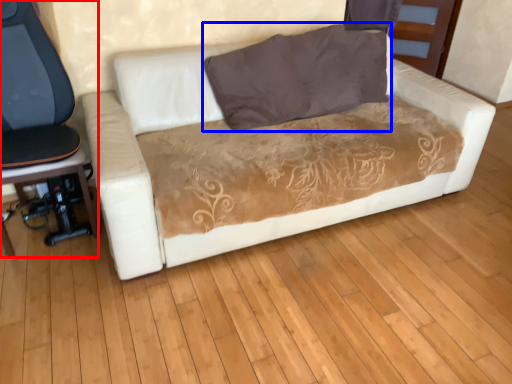
Question: Among these objects, which one is farthest to the camera, chair (highlighted by a red box) or pillow (highlighted by a blue box)?

Choices:
 (A) chair
 (B) pillow

Answer: (B)